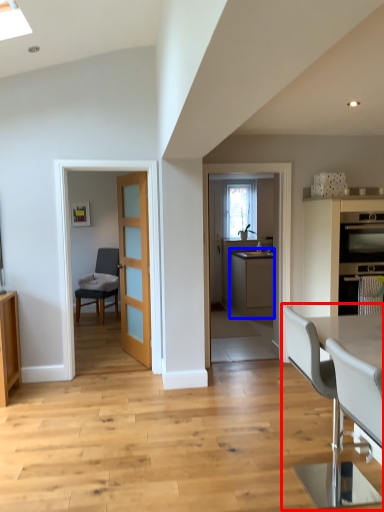
Question: Which object is further to the camera taking this photo, chair (highlighted by a red box) or cabinetry (highlighted by a blue box)?

Choices:
 (A) chair
 (B) cabinetry

Answer: (B)